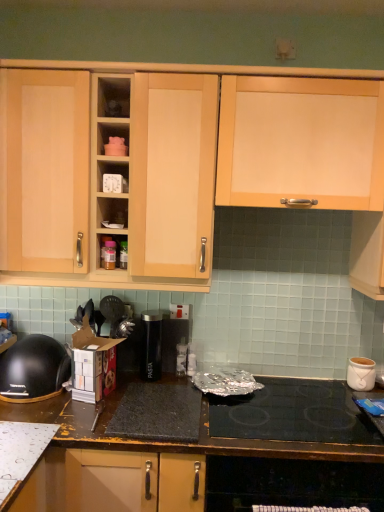
In order to click on vacant space situated on the left part of white ceramic pot at right in this screenshot , I will do `click(322, 388)`.